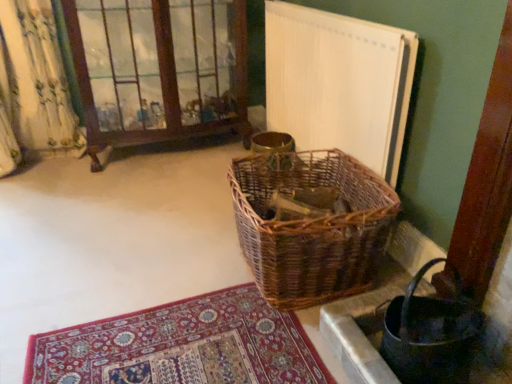
The image size is (512, 384). Find the location of `vacant area in front of brown wooden window frame at upper left`. vacant area in front of brown wooden window frame at upper left is located at coordinates (134, 199).